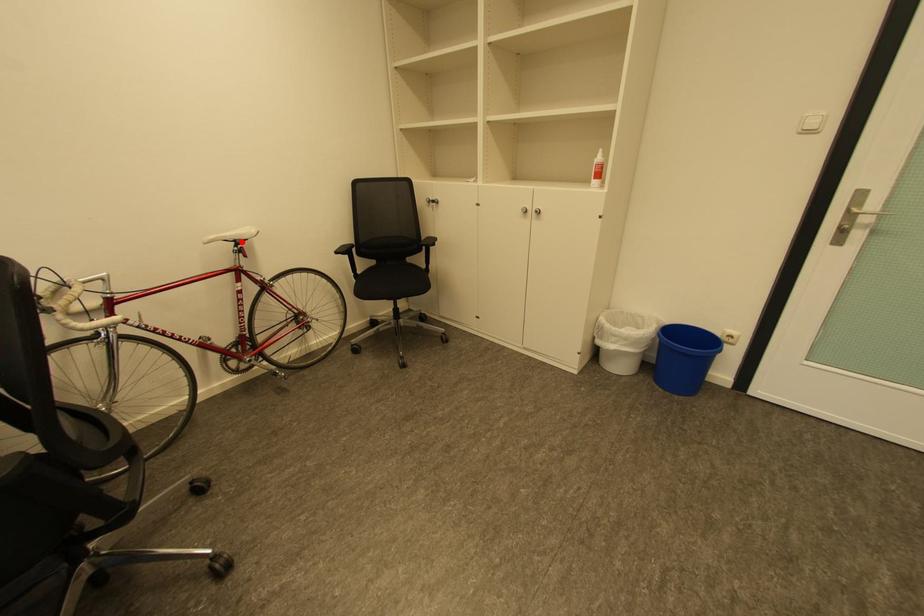
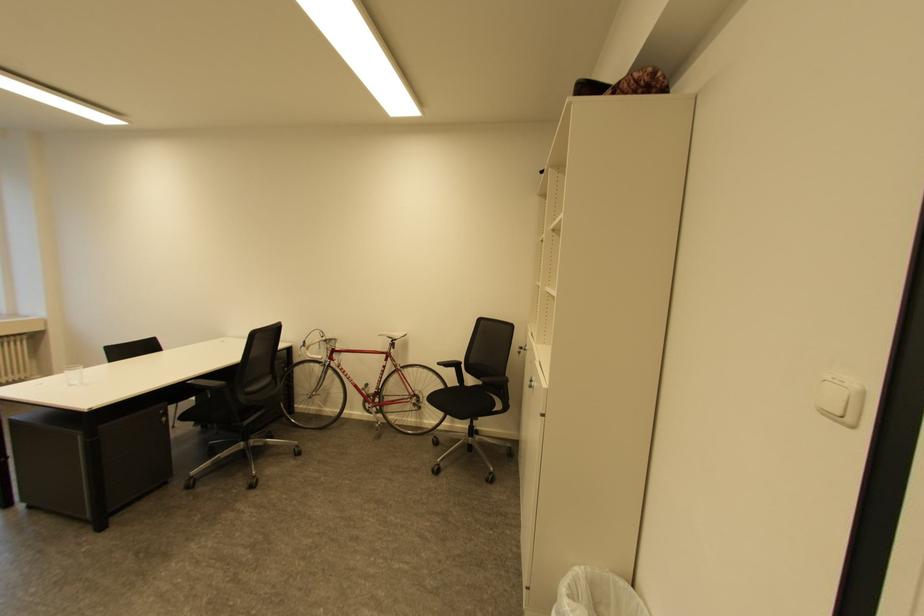
The point at the highlighted location is marked in the first image. Where is the corresponding point in the second image?

(398, 339)